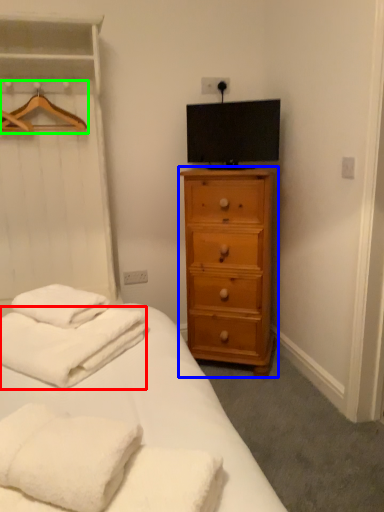
Question: Which object is the farthest from bath towel (highlighted by a red box)? Choose among these: chest of drawers (highlighted by a blue box) or hanger (highlighted by a green box).

Choices:
 (A) chest of drawers
 (B) hanger

Answer: (B)